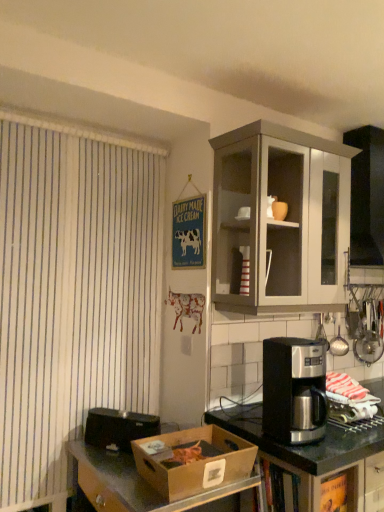
You are a GUI agent. You are given a task and a screenshot of the screen. Output one action in this format:
    pyautogui.click(x=<x>, y=<y>)
    Task: Click on the vacant space situated above metallic silver coffee maker at right (from a real-world perspective)
    This screenshot has width=384, height=512.
    Given the screenshot: What is the action you would take?
    pyautogui.click(x=295, y=342)